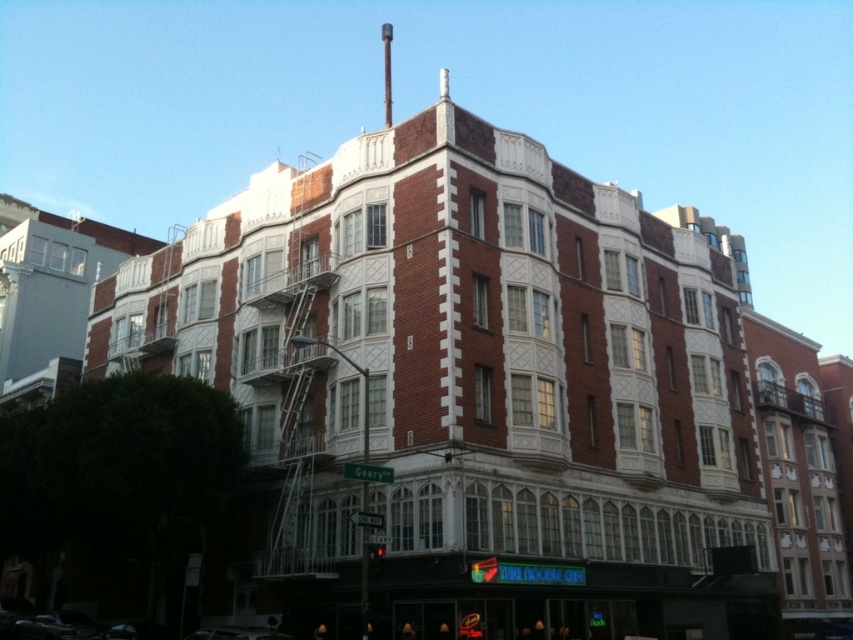
Question: Is brick building at center in front of red brick building at center?

Choices:
 (A) no
 (B) yes

Answer: (B)

Question: Which point appears farthest from the camera in this image?

Choices:
 (A) (444, 589)
 (B) (82, 621)
 (C) (810, 477)

Answer: (C)

Question: Does brick building at center appear under red brick building at center?

Choices:
 (A) yes
 (B) no

Answer: (B)

Question: Is the position of brick building at center less distant than that of shiny silver car at lower left?

Choices:
 (A) no
 (B) yes

Answer: (B)

Question: Which of the following is the closest to the observer?

Choices:
 (A) (73, 630)
 (B) (550, 474)

Answer: (B)

Question: Which of the following is the farthest from the observer?

Choices:
 (A) red brick building at center
 (B) shiny silver car at lower left
 (C) brick building at center

Answer: (A)